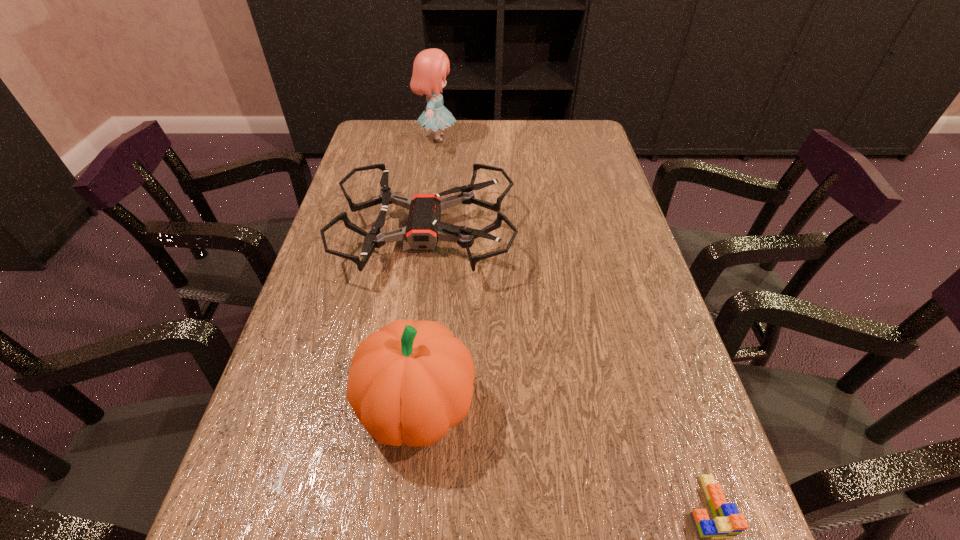
Identify the location of the farthest object. (430, 67).

You are a GUI agent. You are given a task and a screenshot of the screen. Output one action in this format:
    pyautogui.click(x=<x>, y=<y>)
    Task: Click on the tallest object
    
    Given the screenshot: What is the action you would take?
    pyautogui.click(x=430, y=67)

Identify the location of the third shortest object. This screenshot has height=540, width=960. (410, 381).

The image size is (960, 540). What are the coordinates of `the second nearest object` in the screenshot? It's located at (410, 381).

Where is `the second farthest object`? This screenshot has height=540, width=960. the second farthest object is located at coordinates (424, 228).

At what (x,y) coordinates should I click in order to perform the action: click on drone. Please return your answer as a coordinate pair (x, y). This screenshot has height=540, width=960. Looking at the image, I should click on [x=424, y=228].

Locate an element on the screen. Image resolution: width=960 pixels, height=540 pixels. the nearest object is located at coordinates (727, 523).

Where is `Lego`? Lego is located at coordinates (727, 523).

The height and width of the screenshot is (540, 960). In order to click on free space located 0.250m on the front-facing side of the farthest object in this screenshot , I will do `click(534, 138)`.

Find the location of a particular element. vacant point located on the front of the third farthest object is located at coordinates (408, 497).